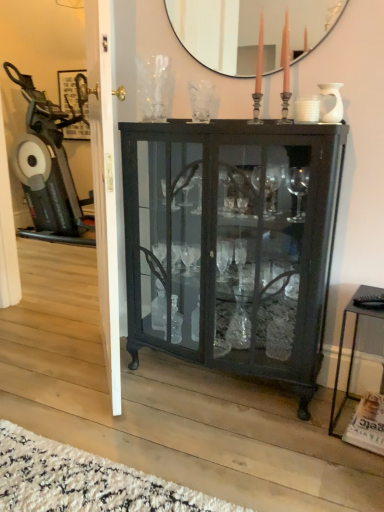
This screenshot has height=512, width=384. I want to click on free area in between black metal side table at lower right and white shag rug at lower left, so click(254, 446).